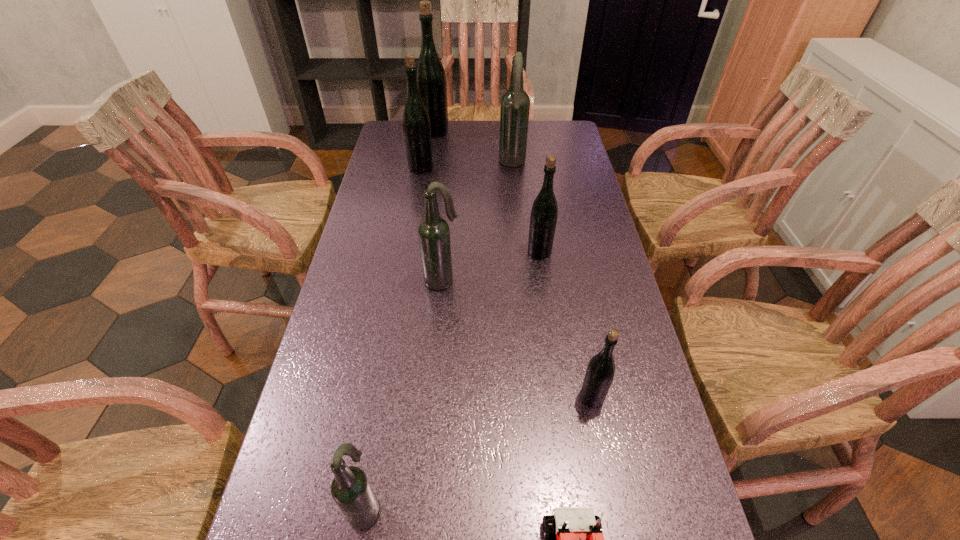
Identify the location of object positioned at the far edge. (431, 78).

The image size is (960, 540). What are the coordinates of `object present at the far left corner` in the screenshot? It's located at (431, 78).

Locate an element on the screen. This screenshot has height=540, width=960. vacant position at the far edge of the desktop is located at coordinates (435, 139).

Where is `free space at the left edge`? free space at the left edge is located at coordinates (409, 169).

This screenshot has width=960, height=540. I want to click on vacant space at the right edge of the desktop, so click(619, 386).

Image resolution: width=960 pixels, height=540 pixels. In the image, there is a desktop. What are the coordinates of `vacant space at the far right corner` in the screenshot? It's located at (534, 128).

Where is `free spot between the second dark beer bottle from left to right and the sixth farthest beer bottle`? The image size is (960, 540). free spot between the second dark beer bottle from left to right and the sixth farthest beer bottle is located at coordinates (516, 339).

You are a GUI agent. You are given a task and a screenshot of the screen. Output one action in this format:
    pyautogui.click(x=<x>, y=<y>)
    Task: Click on the vacant region between the second nearest green beer bottle and the third smallest green beer bottle
    The width and height of the screenshot is (960, 540).
    Given the screenshot: What is the action you would take?
    pyautogui.click(x=480, y=210)

The width and height of the screenshot is (960, 540). In order to click on vacant area that lies between the second nearest green beer bottle and the rightmost green beer bottle in this screenshot , I will do `click(565, 324)`.

Where is `free space between the second green beer bottle from right to left and the biggest dark beer bottle`? free space between the second green beer bottle from right to left and the biggest dark beer bottle is located at coordinates (526, 208).